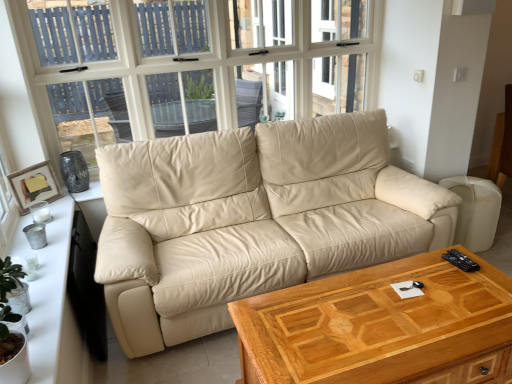
Question: From a real-world perspective, is wooden framed picture at left located higher than white glass window at upper center?

Choices:
 (A) yes
 (B) no

Answer: (B)

Question: From the image's perspective, would you say wooden framed picture at left is shown under white glass window at upper center?

Choices:
 (A) no
 (B) yes

Answer: (B)

Question: Is wooden framed picture at left positioned behind white glass window at upper center?

Choices:
 (A) no
 (B) yes

Answer: (B)

Question: Is wooden framed picture at left to the right of white glass window at upper center from the viewer's perspective?

Choices:
 (A) no
 (B) yes

Answer: (A)

Question: Considering the relative positions of wooden framed picture at left and white glass window at upper center in the image provided, is wooden framed picture at left in front of white glass window at upper center?

Choices:
 (A) no
 (B) yes

Answer: (A)

Question: Does point coord(17,175) appear closer or farther from the camera than point coord(348,185)?

Choices:
 (A) closer
 (B) farther

Answer: (A)

Question: From the image's perspective, is wooden framed picture at left located above or below beige leather couch at center?

Choices:
 (A) above
 (B) below

Answer: (A)

Question: In terms of width, does wooden framed picture at left look wider or thinner when compared to beige leather couch at center?

Choices:
 (A) thin
 (B) wide

Answer: (A)

Question: Looking at the image, does wooden framed picture at left seem bigger or smaller compared to beige leather couch at center?

Choices:
 (A) small
 (B) big

Answer: (A)

Question: From their relative heights in the image, would you say wooden framed picture at left is taller or shorter than wooden coffee table at center?

Choices:
 (A) short
 (B) tall

Answer: (A)

Question: From a real-world perspective, is wooden framed picture at left above or below wooden coffee table at center?

Choices:
 (A) below
 (B) above

Answer: (B)

Question: Would you say wooden framed picture at left is to the left or to the right of wooden coffee table at center in the picture?

Choices:
 (A) left
 (B) right

Answer: (A)

Question: Is point (23, 183) closer or farther from the camera than point (434, 314)?

Choices:
 (A) closer
 (B) farther

Answer: (B)

Question: Choose the correct answer: Is beige leather couch at center inside wooden coffee table at center or outside it?

Choices:
 (A) outside
 (B) inside

Answer: (A)

Question: In terms of width, does beige leather couch at center look wider or thinner when compared to wooden coffee table at center?

Choices:
 (A) thin
 (B) wide

Answer: (B)